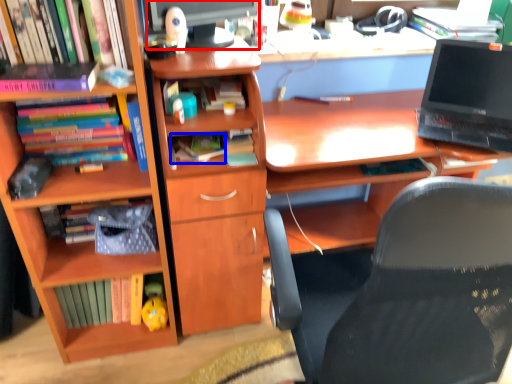
Question: Which object is closer to the camera taking this photo, computer monitor (highlighted by a red box) or book (highlighted by a blue box)?

Choices:
 (A) computer monitor
 (B) book

Answer: (A)